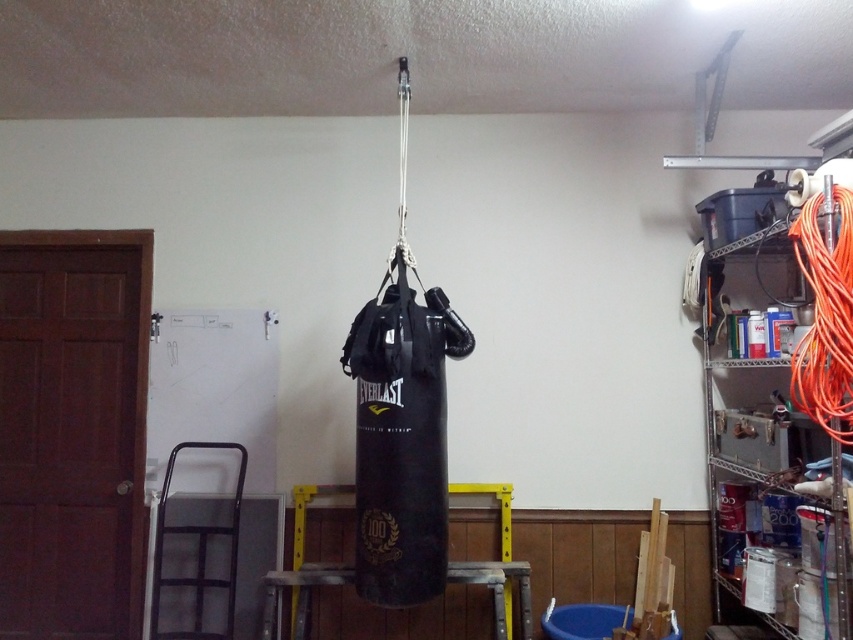
Question: Is orange cable at right bigger than metallic wire shelving at right?

Choices:
 (A) no
 (B) yes

Answer: (A)

Question: Among these objects, which one is farthest from the camera?

Choices:
 (A) orange cable at right
 (B) metallic wire shelving at right

Answer: (B)

Question: Can you confirm if orange cable at right is positioned to the left of metallic wire shelving at right?

Choices:
 (A) no
 (B) yes

Answer: (B)

Question: Is orange cable at right bigger than metallic wire shelving at right?

Choices:
 (A) yes
 (B) no

Answer: (B)